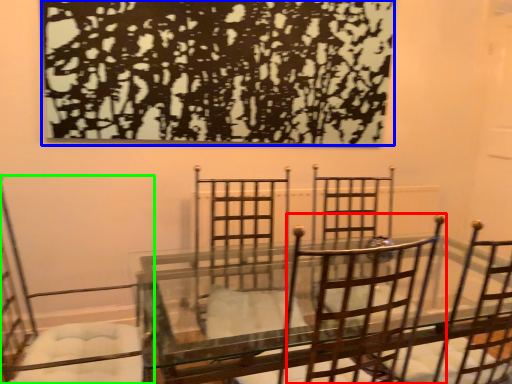
Question: Considering the real-world distances, which object is farthest from chair (highlighted by a red box)? tree (highlighted by a blue box) or chair (highlighted by a green box)?

Choices:
 (A) tree
 (B) chair

Answer: (B)